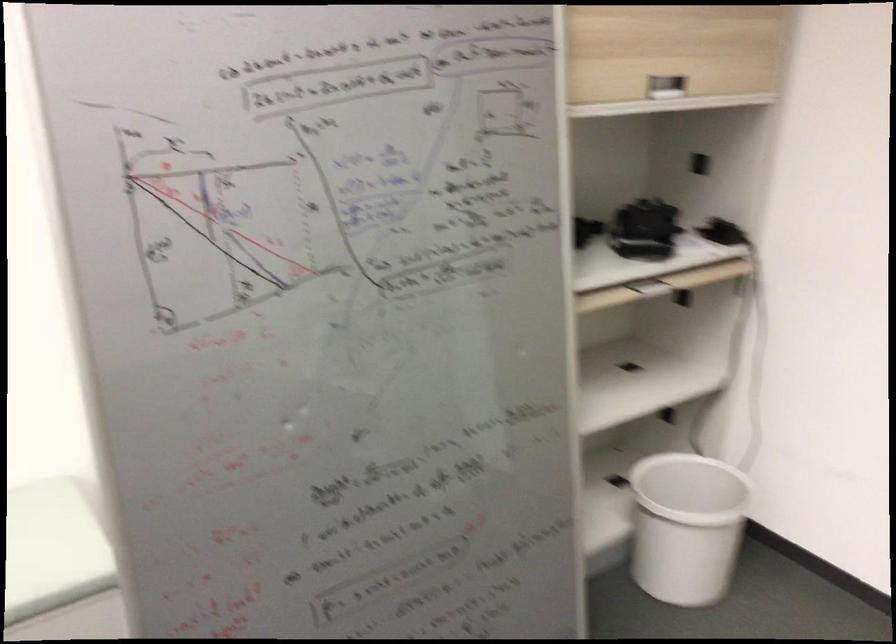
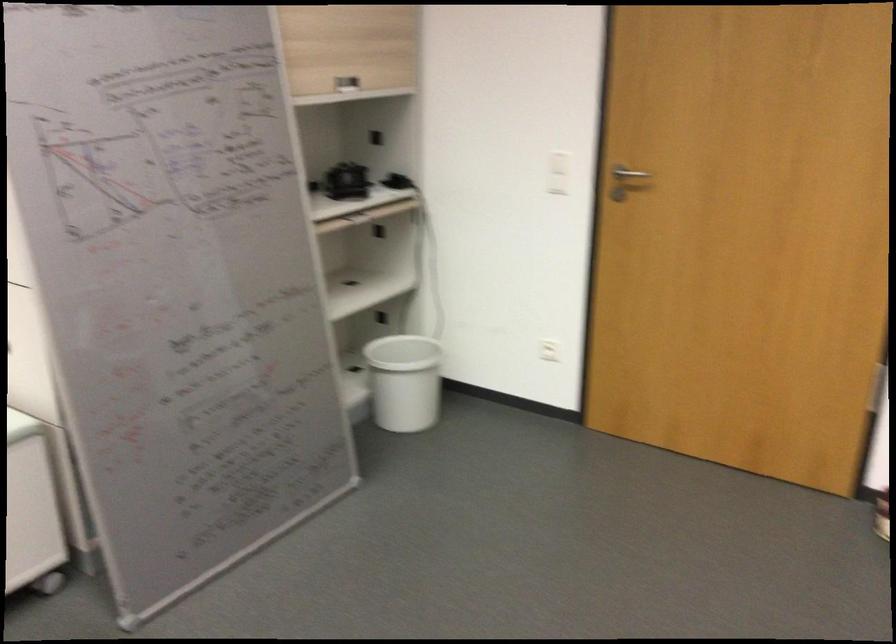
Question: Which direction would the cameraman need to move to produce the second image? Reply with the corresponding letter.

Choices:
 (A) Left
 (B) Right
 (C) Forward
 (D) Backward

Answer: (D)